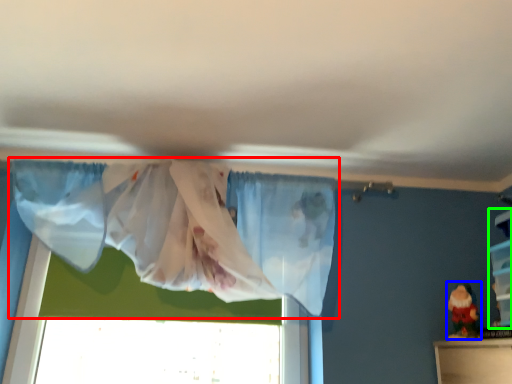
Question: Based on their relative distances, which object is nearer to curtain (highlighted by a red box)? Choose from toy (highlighted by a blue box) and shelf (highlighted by a green box).

Choices:
 (A) toy
 (B) shelf

Answer: (A)